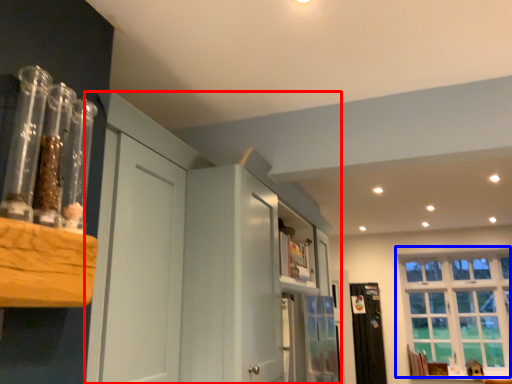
Question: Which point is closer to the camera, dresser (highlighted by a red box) or window (highlighted by a blue box)?

Choices:
 (A) dresser
 (B) window

Answer: (A)